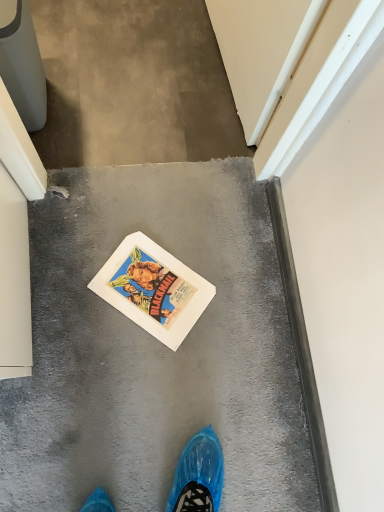
The height and width of the screenshot is (512, 384). What do you see at coordinates (153, 289) in the screenshot?
I see `white paper comic book at center` at bounding box center [153, 289].

This screenshot has width=384, height=512. I want to click on white paper comic book at center, so click(x=153, y=289).

At what (x,y) coordinates should I click in order to perform the action: click on white paper comic book at center. Please return your answer as a coordinate pair (x, y). This screenshot has height=512, width=384. Looking at the image, I should click on (153, 289).